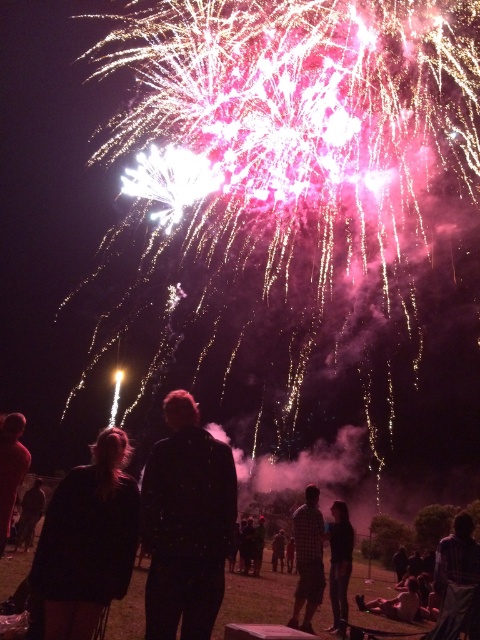
You are a photographer trying to capture a photo of the fireworks display. You notice two people in the scene, one with dark gray pants at lower right and another with dark brown hair at lower left. To ensure both are in frame, which direction should you move your camera to the right or left?

Since the dark gray pants at lower right is to the right of dark brown hair at lower left, you should move your camera to the left to ensure both are in frame.

Looking at this image, you are a photographer trying to capture the fireworks display. You notice two people in the foreground wearing a dark plaid shirt at lower right and a checkered fabric shirt at center. Which person should you focus on to ensure their entire outfit fits within your camera frame, considering their size in the image?

The dark plaid shirt at lower right occupies less space than the checkered fabric shirt at center, so focusing on the person wearing the dark plaid shirt at lower right would ensure their entire outfit fits within the camera frame.

You are standing at the point where the viewer is located in the fireworks display scene. There is a specific point marked at coordinates point (443,621). If you want to move closer to this point, which direction should you walk?

You should walk towards the point (443,621). Since the point and viewer are 23.48 meters apart, moving in the direction facing the fireworks display would bring you closer to the point.